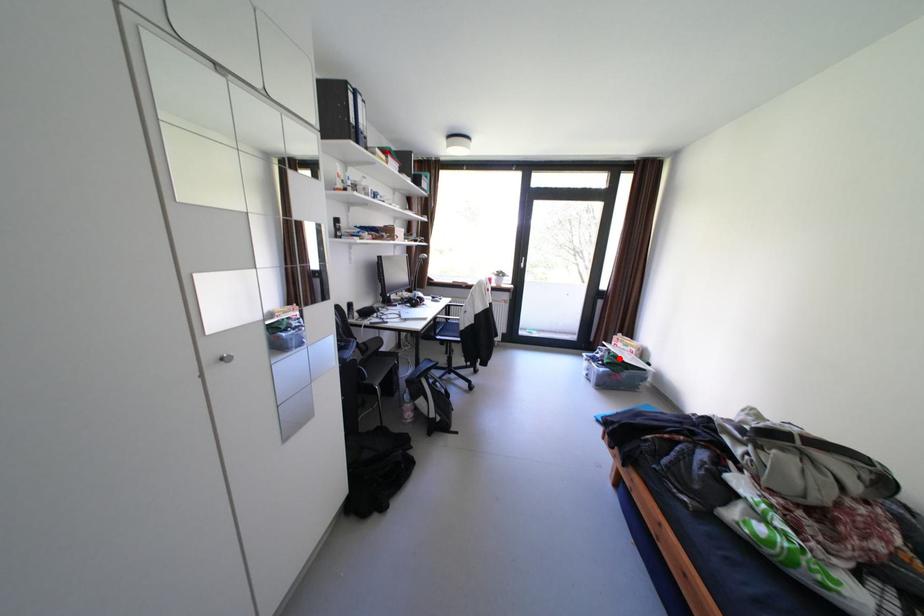
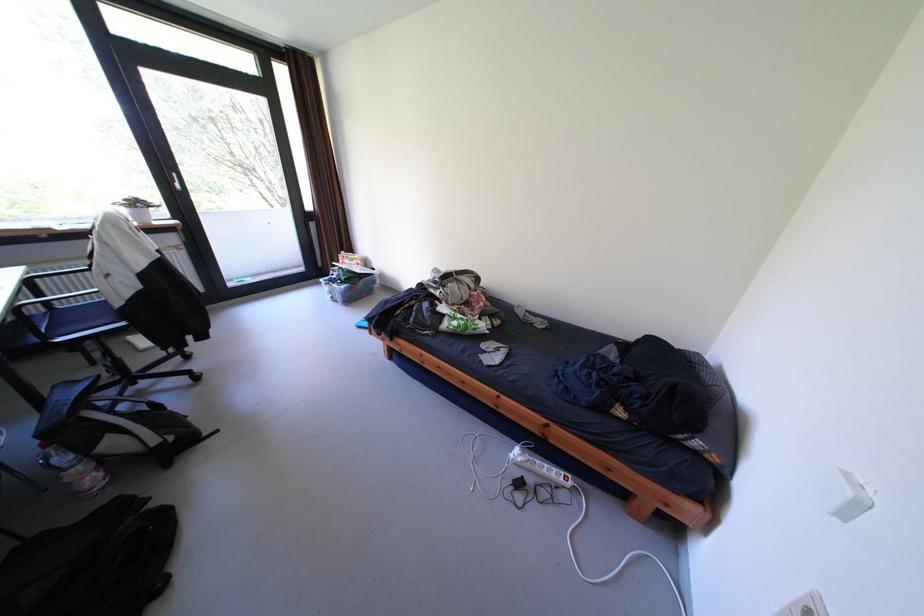
The point at the highlighted location is marked in the first image. Where is the corresponding point in the second image?

(355, 275)